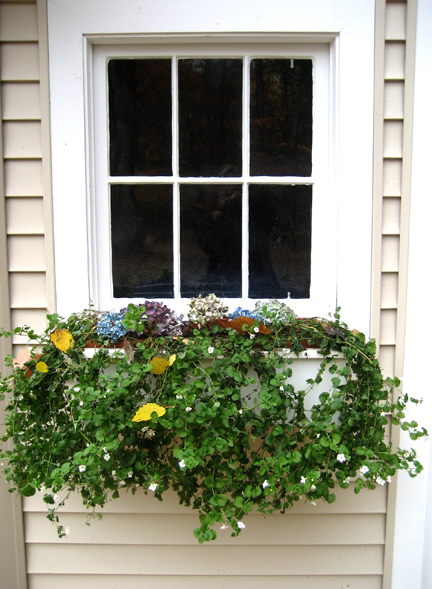
Where is `smudge on window`? smudge on window is located at coordinates (226, 196), (219, 204), (227, 167).